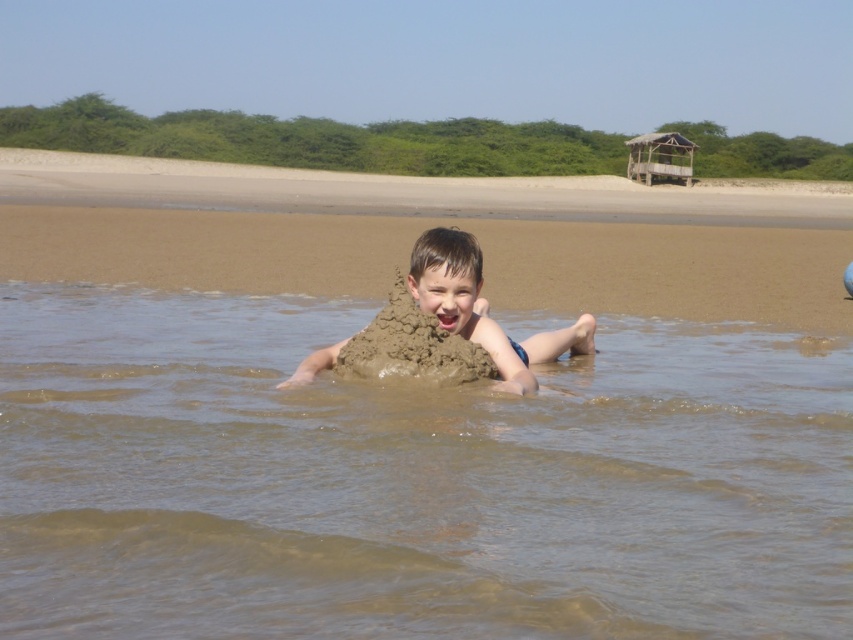
Question: Can you confirm if brown sandcastle at center is thinner than brown sandy mud at center?

Choices:
 (A) no
 (B) yes

Answer: (A)

Question: Estimate the real-world distances between objects in this image. Which object is closer to the brown sandy mud at center?

Choices:
 (A) brown sandcastle at center
 (B) brown wet sand at center

Answer: (B)

Question: Which of these objects is positioned closest to the brown sandcastle at center?

Choices:
 (A) brown sandy mud at center
 (B) brown wet sand at center

Answer: (A)

Question: Does brown sandcastle at center have a lesser width compared to brown sandy mud at center?

Choices:
 (A) yes
 (B) no

Answer: (B)

Question: Estimate the real-world distances between objects in this image. Which object is closer to the brown sandy mud at center?

Choices:
 (A) brown wet sand at center
 (B) brown sandcastle at center

Answer: (A)

Question: Does brown wet sand at center appear over brown sandcastle at center?

Choices:
 (A) yes
 (B) no

Answer: (B)